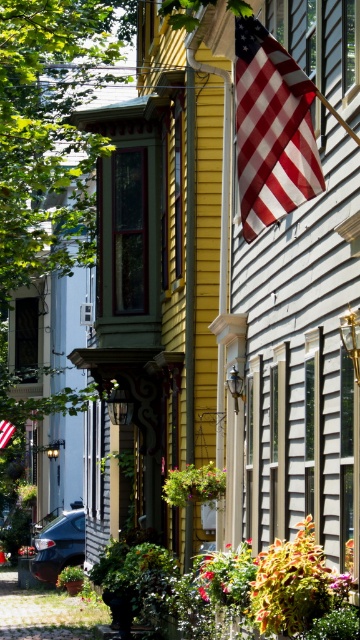
Between point (257, 64) and point (3, 429), which one is positioned behind?

Positioned behind is point (3, 429).

Is point (272, 179) farther from viewer compared to point (6, 424)?

No, (272, 179) is closer to viewer.

Does point (300, 179) lie behind point (10, 422)?

No.

Locate an element on the screen. The height and width of the screenshot is (640, 360). american flag at upper right is located at coordinates (272, 129).